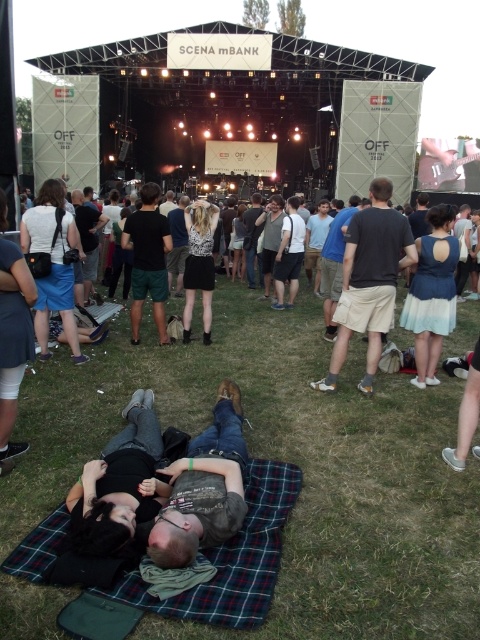
Question: Does dark blue jeans at lower center lie in front of white cotton shirt at center?

Choices:
 (A) no
 (B) yes

Answer: (B)

Question: Estimate the real-world distances between objects in this image. Which object is closer to the black matte shirt at lower left?

Choices:
 (A) glittery silver dress at center
 (B) black cotton shorts at center
 (C) white cotton shirt at center

Answer: (C)

Question: Which of the following is the farthest from the observer?

Choices:
 (A) black cotton t-shirt at center
 (B) dark blue jeans at lower center

Answer: (A)

Question: Is black matte shirt at lower left further to the viewer compared to black cotton t-shirt at center?

Choices:
 (A) no
 (B) yes

Answer: (A)

Question: Is black cotton t-shirt at center closer to camera compared to blue satin dress at center?

Choices:
 (A) yes
 (B) no

Answer: (A)

Question: Estimate the real-world distances between objects in this image. Which object is farther from the blue satin dress at center?

Choices:
 (A) plaid fabric blanket at lower center
 (B) black cotton shorts at center
 (C) glittery silver dress at center
 (D) dark blue jeans at lower center

Answer: (B)